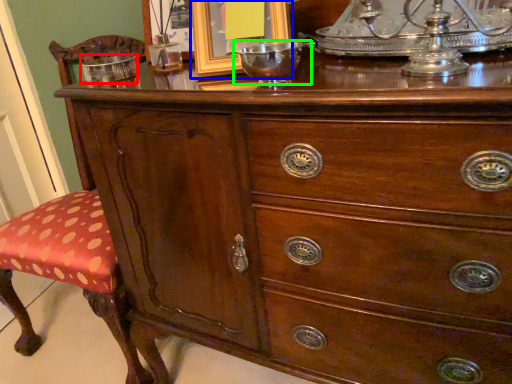
Question: Estimate the real-world distances between objects in this image. Which object is closer to bowl (highlighted by a red box), picture frame (highlighted by a blue box) or glass bowl (highlighted by a green box)?

Choices:
 (A) picture frame
 (B) glass bowl

Answer: (A)